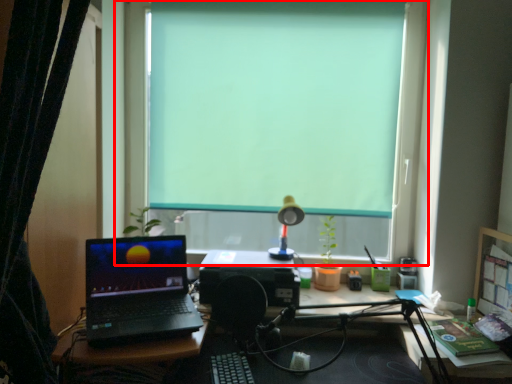
Question: In this image, where is window (annotated by the red box) located relative to curtain?

Choices:
 (A) right
 (B) left

Answer: (A)